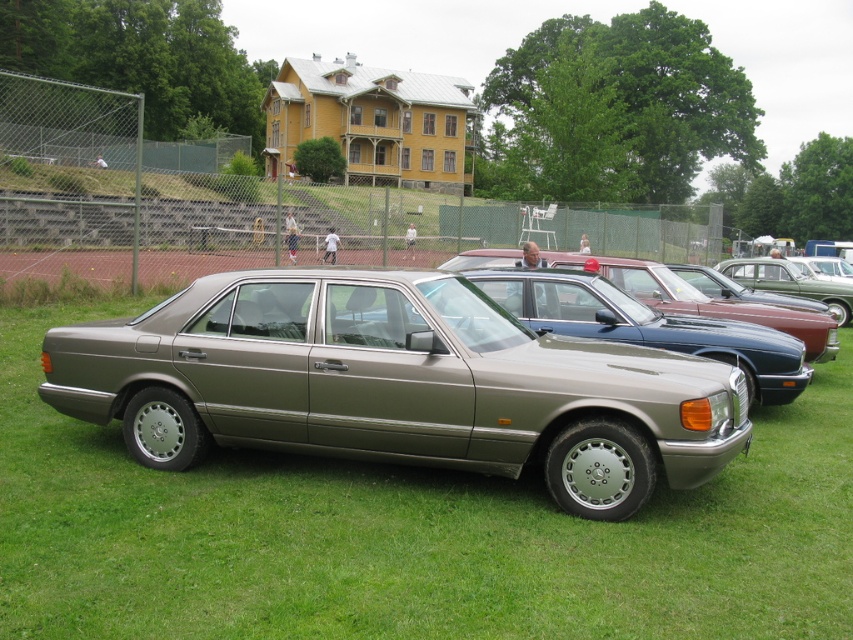
You are a photographer standing at the edge of the grassy area where the cars are parked. You want to take a photo that includes both the satin silver car at center and the metallic red car at center without any obstructions. Given that your camera has a maximum zoom range that can capture objects up to 10 meters apart, will you be able to capture both cars in a single frame?

The distance between the satin silver car at center and the metallic red car at center is 10.71 meters. Since your camera can only capture up to 10 meters, you won cannot capture both cars in a single frame without moving closer or adjusting your position.